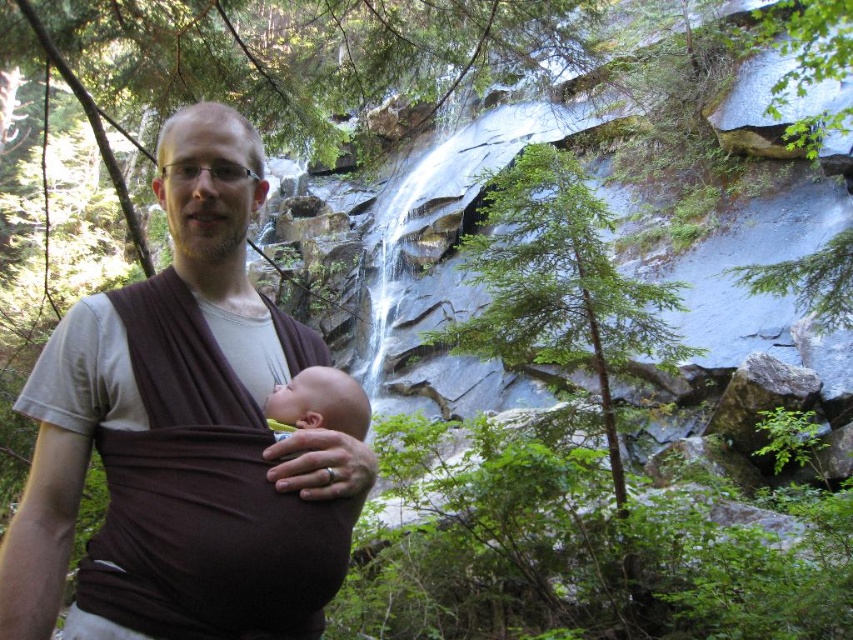
You are a photographer trying to capture a candid shot of the baby in the brown fabric baby carrier at center and the smooth brown baby at center. Which of the two subjects is positioned lower in the image?

The brown fabric baby carrier at center is located below the smooth brown baby at center, so the brown fabric baby carrier at center is positioned lower in the image.

You are a photographer trying to capture the baby in the brown fabric baby carrier at center. Given that the camera focuses on objects at point coordinates between 0.5 and 0.7 on the x and y axes, will the baby be in focus?

Result: The brown fabric baby carrier at center is located at point coordinates of 0.681 on the x and 0.216 on the y. Since the y coordinate of 0.216 is below the minimum focus range of 0.5, the baby will not be in focus.

You are a photographer trying to capture a closeup of the baby in the scene. The camera lens can only focus on objects wider than 30 cm. Given that the brown fabric baby carrier at center and the smooth brown baby at center are both in the center, which one is wider and can be focused on?

The smooth brown baby at center is wider than the brown fabric baby carrier at center. Since the camera lens can only focus on objects wider than 30 cm, the smooth brown baby at center can be focused on if it meets the width requirement.